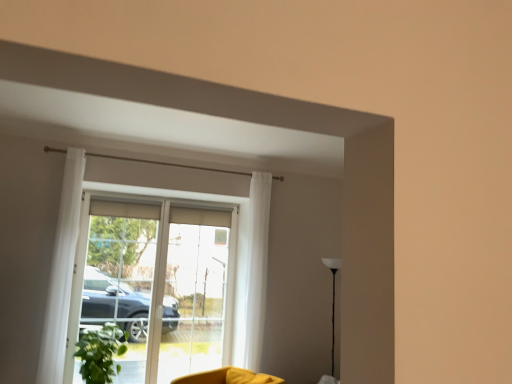
Question: Would you say green matte plant at lower left is inside or outside white glossy floor lamp at right?

Choices:
 (A) outside
 (B) inside

Answer: (A)

Question: From the image's perspective, is green matte plant at lower left above or below white glossy floor lamp at right?

Choices:
 (A) below
 (B) above

Answer: (A)

Question: Which object is positioned closest to the green matte plant at lower left?

Choices:
 (A) white sheer curtain at center, acting as the first curtain starting from the back
 (B) transparent glass screen door at center, which is counted as the 2th screen door, starting from the left
 (C) yellow fabric swivel chair at lower center
 (D) white sheer curtain at left, which appears as the first curtain when viewed from the left
 (E) transparent glass door at center

Answer: (D)

Question: Estimate the real-world distances between objects in this image. Which object is farther from the green matte plant at lower left?

Choices:
 (A) transparent glass door at center
 (B) white sheer curtain at left, which appears as the first curtain when viewed from the left
 (C) translucent glass screen door at center, acting as the first screen door starting from the left
 (D) white sheer curtain at center, acting as the first curtain starting from the back
 (E) white glossy floor lamp at right

Answer: (E)